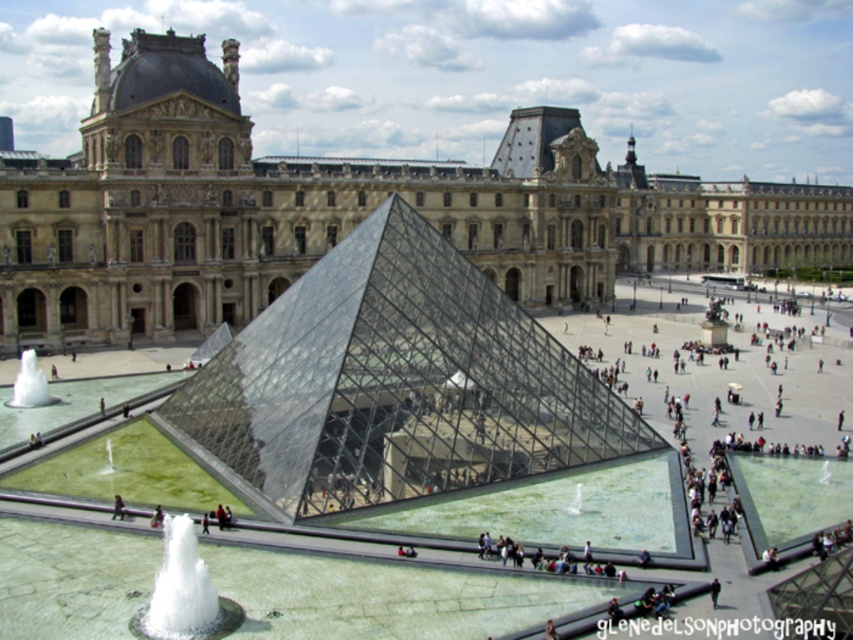
You are standing in front of the Louvre Museum and see the white frothy water at lower left and the white frothy water at center. Which one appears taller?

The white frothy water at lower left appears taller than the white frothy water at center.

You are standing at the entrance of the Louvre Museum and see the white frothy water at lower left and the white frothy water at center. Which one is positioned lower in the image?

The white frothy water at lower left is positioned lower in the image than the white frothy water at center.

You are an architect visiting the Louvre Museum and want to compare the widths of the beige stone palace at center and the transparent glass pyramid at center. Which one is wider?

The beige stone palace at center is wider than the transparent glass pyramid at center according to the description.